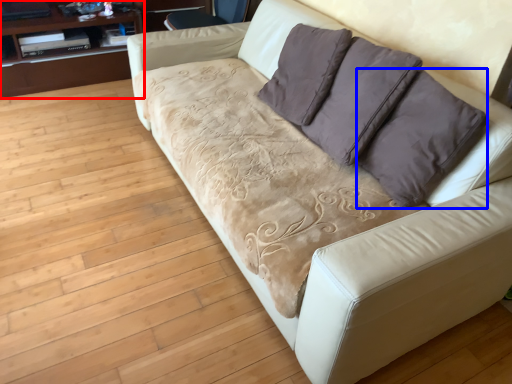
Question: Which object appears closest to the camera in this image, dresser (highlighted by a red box) or throw pillow (highlighted by a blue box)?

Choices:
 (A) dresser
 (B) throw pillow

Answer: (B)